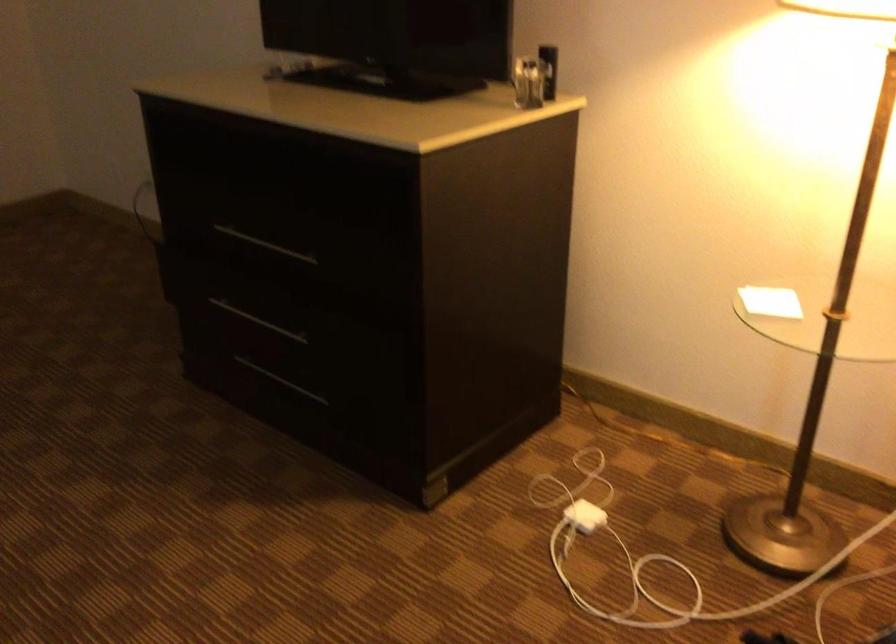
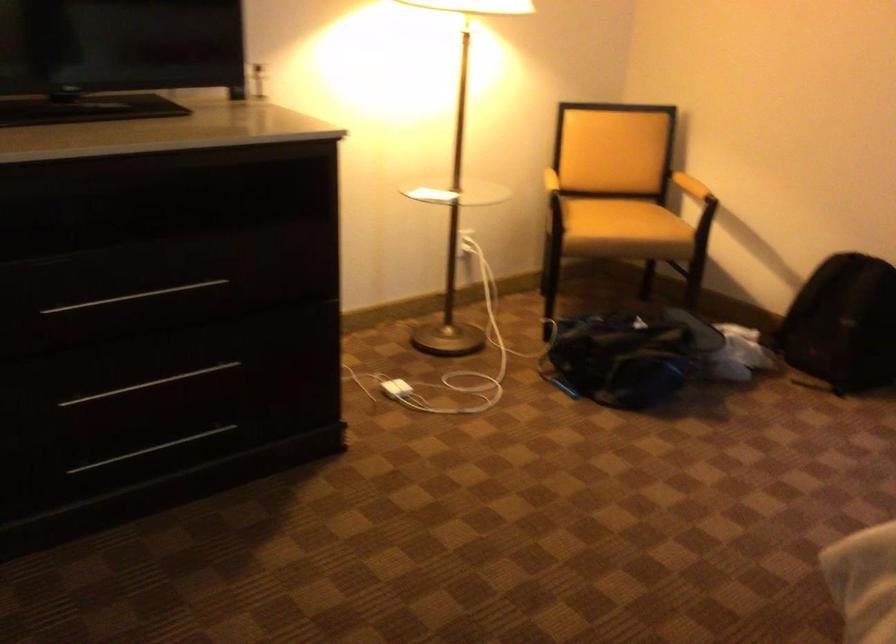
Find the pixel in the second image that matches the point at 274,247 in the first image.

(134, 297)